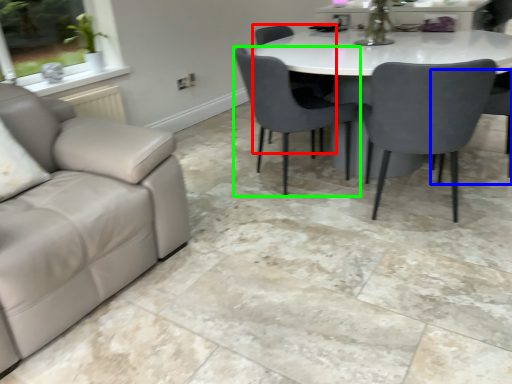
Question: Estimate the real-world distances between objects in this image. Which object is closer to chair (highlighted by a red box), chair (highlighted by a blue box) or chair (highlighted by a green box)?

Choices:
 (A) chair
 (B) chair

Answer: (B)